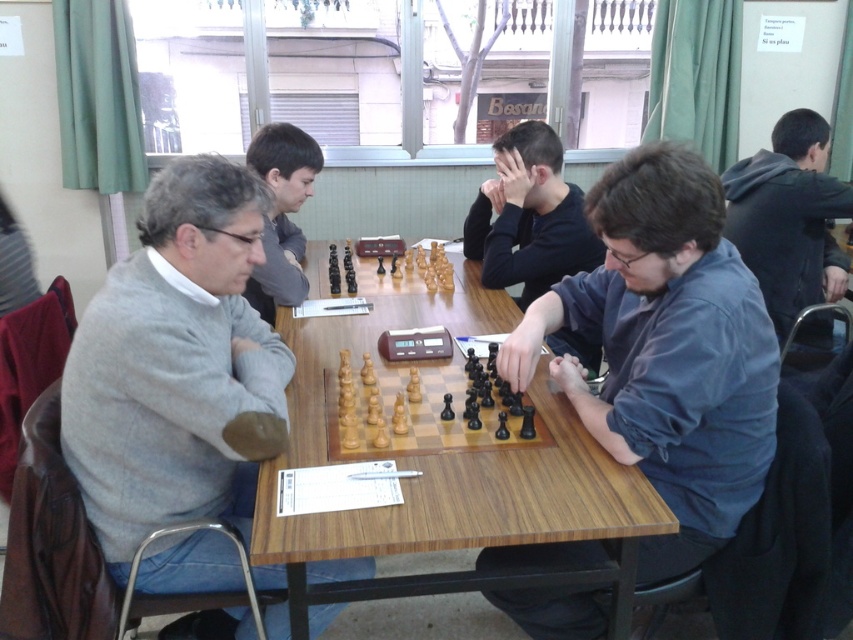
Which is more to the left, dark blue shirt at center or smooth gray sweater at upper left?

smooth gray sweater at upper left

Image resolution: width=853 pixels, height=640 pixels. In order to click on dark blue shirt at center in this screenshot , I will do `click(529, 216)`.

Locate an element on the screen. dark blue shirt at center is located at coordinates (529, 216).

Which is above, blue shirt at center or wooden chessboard at center?

Positioned higher is wooden chessboard at center.

Measure the distance between blue shirt at center and camera.

blue shirt at center and camera are 4.28 feet apart.

The image size is (853, 640). In order to click on blue shirt at center in this screenshot , I will do `click(666, 349)`.

Who is more forward, (111, 460) or (390, 372)?

Point (111, 460) is more forward.

The image size is (853, 640). Find the location of `gray sweater at left`. gray sweater at left is located at coordinates (177, 365).

Find the location of a particular element. Image resolution: width=853 pixels, height=640 pixels. gray sweater at left is located at coordinates coord(177,365).